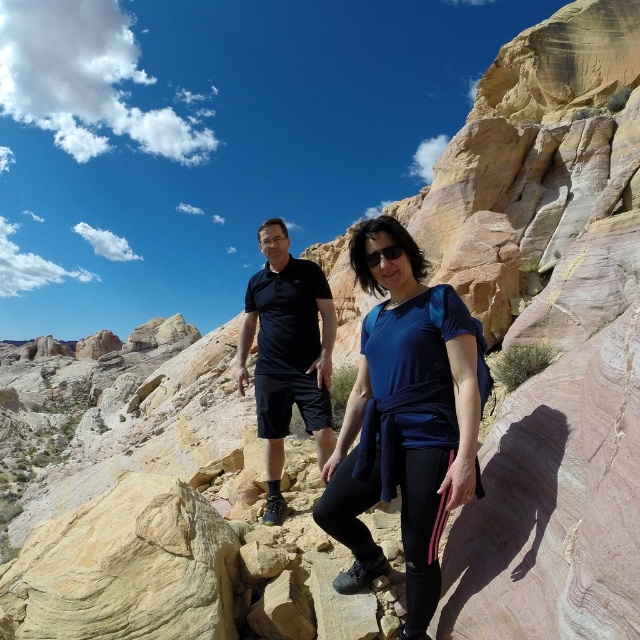
Question: Among these objects, which one is nearest to the camera?

Choices:
 (A) blue fabric shirt at center
 (B) matte black polo shirt at center

Answer: (A)

Question: Can you confirm if blue fabric shirt at center is smaller than matte black polo shirt at center?

Choices:
 (A) yes
 (B) no

Answer: (B)

Question: Is blue fabric shirt at center closer to the viewer compared to matte black polo shirt at center?

Choices:
 (A) no
 (B) yes

Answer: (B)

Question: Does blue fabric shirt at center appear under matte black polo shirt at center?

Choices:
 (A) yes
 (B) no

Answer: (B)